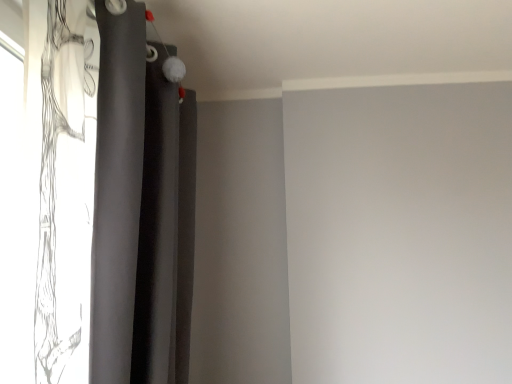
The width and height of the screenshot is (512, 384). Identify the location of matte gray curtain at left. (140, 208).

What do you see at coordinates (140, 208) in the screenshot?
I see `matte gray curtain at left` at bounding box center [140, 208].

Find the location of a particular element. This screenshot has height=384, width=512. matte gray curtain at left is located at coordinates (140, 208).